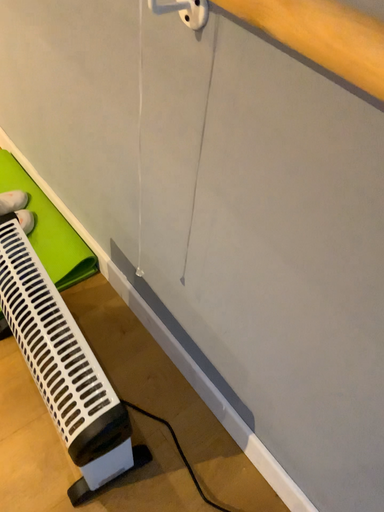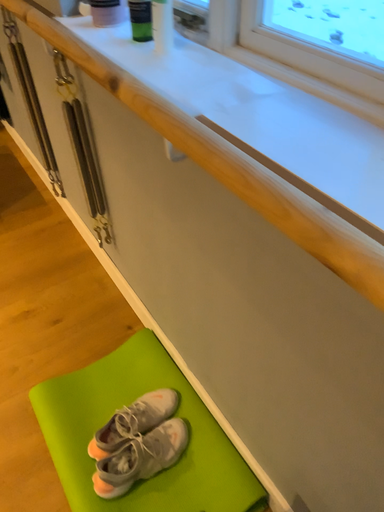
Question: Which way did the camera rotate in the video?

Choices:
 (A) rotated downward
 (B) rotated upward

Answer: (B)